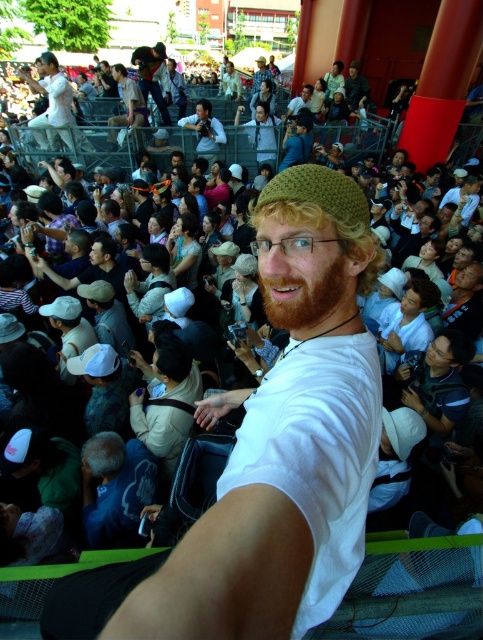
Question: Estimate the real-world distances between objects in this image. Which object is farther from the matte black camera at upper center?

Choices:
 (A) reddish-brown hair at center
 (B) blue cotton shirt at lower left
 (C) green knitted hat at center

Answer: (A)

Question: Does blue cotton shirt at lower left appear on the left side of matte black camera at center?

Choices:
 (A) no
 (B) yes

Answer: (A)

Question: Which point is closer to the camera taking this photo?

Choices:
 (A) [168, 118]
 (B) [113, 497]
 (C) [232, 609]
 (D) [218, 140]

Answer: (C)

Question: Does matte black camera at upper center appear on the left side of white fabric cap at left?

Choices:
 (A) yes
 (B) no

Answer: (A)

Question: Which object is the farthest from the white cotton shirt at center?

Choices:
 (A) light brown hair at center
 (B) matte black camera at center
 (C) white fabric cap at left

Answer: (A)

Question: Does matte black camera at upper center appear over matte black camera at center?

Choices:
 (A) yes
 (B) no

Answer: (A)